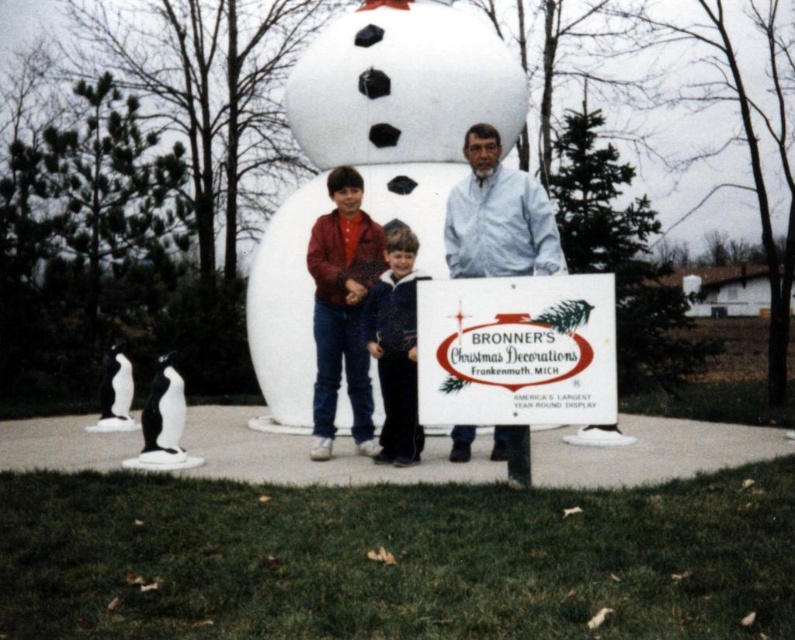
This screenshot has width=795, height=640. What do you see at coordinates (371, 161) in the screenshot? I see `white matte snowman at center` at bounding box center [371, 161].

Which is behind, point (316, 84) or point (165, 381)?

The point (316, 84) is behind.

Locate an element on the screen. Image resolution: width=795 pixels, height=640 pixels. white matte snowman at center is located at coordinates (371, 161).

The height and width of the screenshot is (640, 795). I want to click on white matte snowman at center, so click(x=371, y=161).

Does point (277, 296) come in front of point (332, 352)?

That is False.

Can you confirm if white matte snowman at center is taller than matte red jacket at center?

Correct, white matte snowman at center is much taller as matte red jacket at center.

In order to click on white matte snowman at center in this screenshot , I will do `click(371, 161)`.

Image resolution: width=795 pixels, height=640 pixels. Identify the location of white matte snowman at center. (371, 161).

Between point (493, 60) and point (425, 358), which one is positioned in front?

Point (425, 358) is in front.

You are a GUI agent. You are given a task and a screenshot of the screen. Output one action in this format:
    pyautogui.click(x=<x>, y=<y>)
    Task: Click on the white matte snowman at center
    The width and height of the screenshot is (795, 640).
    Given the screenshot: What is the action you would take?
    pyautogui.click(x=371, y=161)